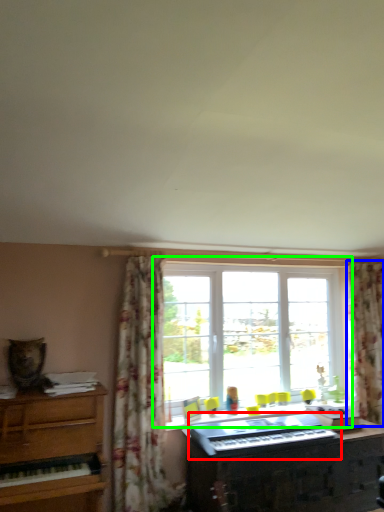
Question: Which object is the closest to the musical keyboard (highlighted by a red box)? Choose among these: curtain (highlighted by a blue box) or window (highlighted by a green box).

Choices:
 (A) curtain
 (B) window

Answer: (B)